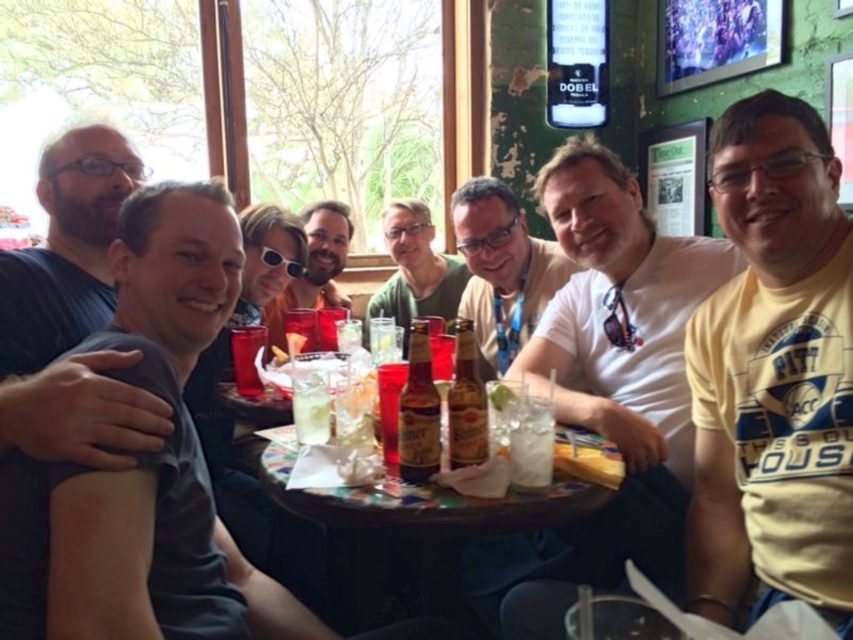
Can you confirm if wooden table at center is thinner than clear glass at table center?

In fact, wooden table at center might be wider than clear glass at table center.

Identify the location of wooden table at center. The height and width of the screenshot is (640, 853). (415, 538).

Find the location of a particular element. The height and width of the screenshot is (640, 853). wooden table at center is located at coordinates (415, 538).

Based on the photo, who is positioned more to the left, matte black sunglasses at center or brown glass bottle at center?

matte black sunglasses at center

Is matte black sunglasses at center positioned behind brown glass bottle at center?

Yes, it is behind brown glass bottle at center.

Which is behind, point (315, 298) or point (473, 448)?

Positioned behind is point (315, 298).

Identify the location of matte black sunglasses at center. (314, 268).

Which is below, dark gray t-shirt at left or white cotton shirt at center?

dark gray t-shirt at left is below.

Does dark gray t-shirt at left have a greater width compared to white cotton shirt at center?

No.

Is point (273, 593) positioned before point (625, 531)?

Yes.

You are a GUI agent. You are given a task and a screenshot of the screen. Output one action in this format:
    pyautogui.click(x=<x>, y=<y>)
    Task: Click on the dark gray t-shirt at left
    
    Given the screenshot: What is the action you would take?
    pyautogui.click(x=144, y=465)